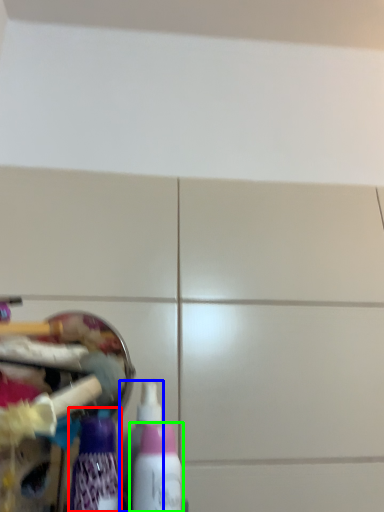
Question: Which object is the closest to the bottle (highlighted by a red box)? Choose among these: bottle (highlighted by a blue box) or bottle (highlighted by a green box).

Choices:
 (A) bottle
 (B) bottle

Answer: (B)